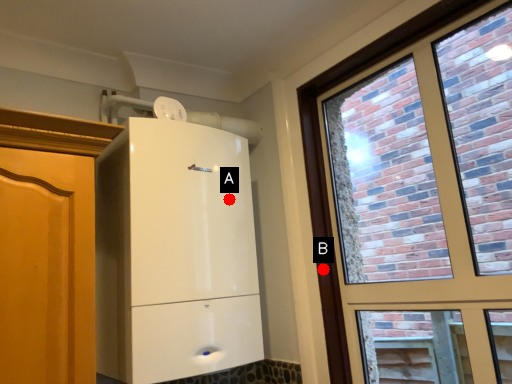
Question: Two points are circled on the image, labeled by A and B beside each circle. Which point is farther to the camera?

Choices:
 (A) A is further
 (B) B is further

Answer: (B)